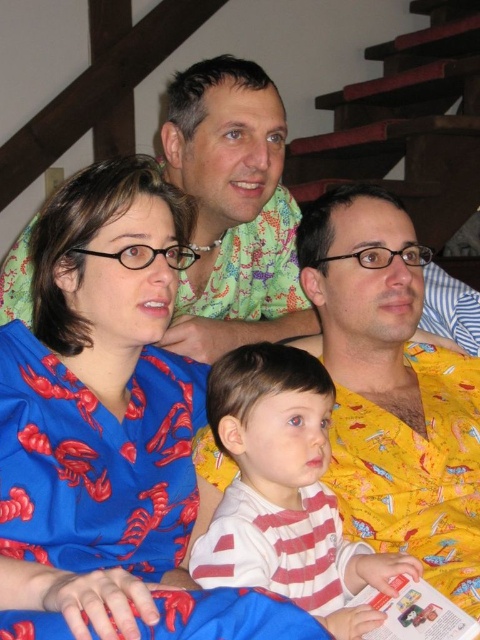
Does green floral shirt at upper center come in front of white striped shirt at center?

No.

Which is behind, point (255, 163) or point (296, 392)?

Positioned behind is point (255, 163).

The image size is (480, 640). In order to click on green floral shirt at upper center in this screenshot , I will do `click(233, 209)`.

Consider the image. Is blue satin blouse at center below matte paper magazine at lower right?

No.

Which is above, blue satin blouse at center or matte paper magazine at lower right?

blue satin blouse at center

Which is behind, point (92, 192) or point (409, 604)?

Positioned behind is point (92, 192).

The image size is (480, 640). Find the location of `blue satin blouse at center`. blue satin blouse at center is located at coordinates (108, 429).

Is green floral shirt at upper center below matte paper magazine at lower right?

No, green floral shirt at upper center is not below matte paper magazine at lower right.

The width and height of the screenshot is (480, 640). Describe the element at coordinates (233, 209) in the screenshot. I see `green floral shirt at upper center` at that location.

Where is `green floral shirt at upper center`? green floral shirt at upper center is located at coordinates 233,209.